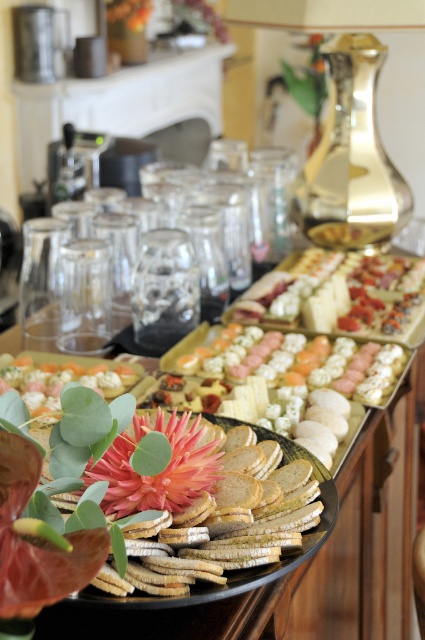
Question: Among these objects, which one is nearest to the camera?

Choices:
 (A) white crumbly cheese at center
 (B) white cracker at center

Answer: (B)

Question: Considering the relative positions of sliced cheese at center and white cracker at center in the image provided, where is sliced cheese at center located with respect to white cracker at center?

Choices:
 (A) above
 (B) below

Answer: (A)

Question: Can you confirm if white crumbly cheese at center is bigger than white cracker at center?

Choices:
 (A) no
 (B) yes

Answer: (B)

Question: From the image, what is the correct spatial relationship of sliced cheese at center in relation to white crumbly cheese at center?

Choices:
 (A) below
 (B) above

Answer: (B)

Question: Which object is farther from the camera taking this photo?

Choices:
 (A) sliced cheese at center
 (B) white cracker at center

Answer: (A)

Question: Which object appears farthest from the camera in this image?

Choices:
 (A) white cracker at center
 (B) white crumbly cheese at center

Answer: (B)